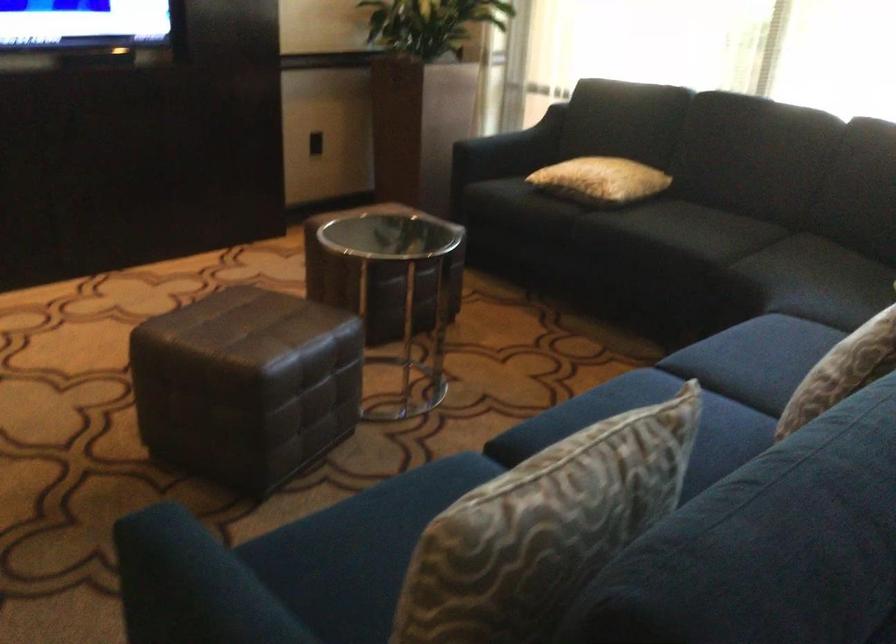
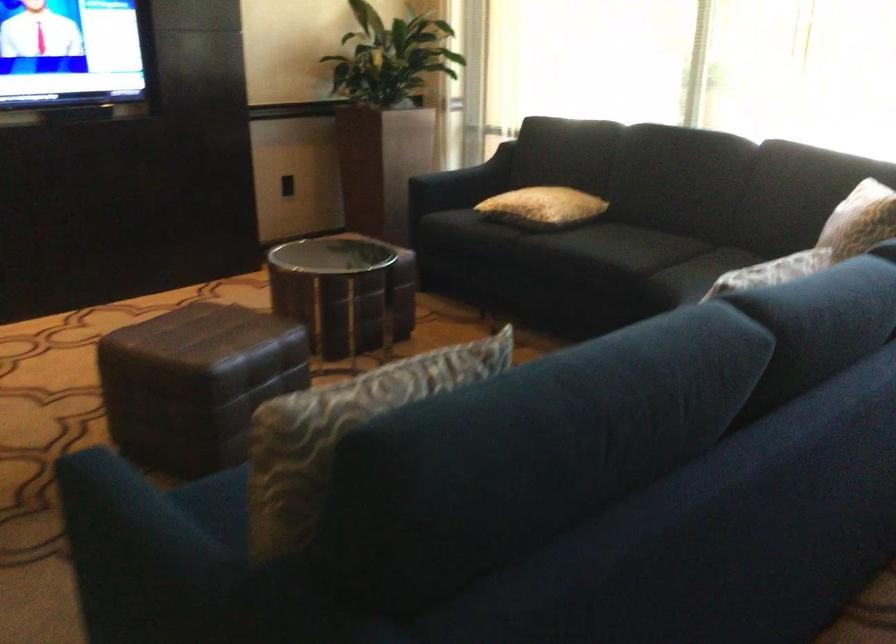
Question: The first image is from the beginning of the video and the second image is from the end. How did the camera likely rotate when shooting the video?

Choices:
 (A) Left
 (B) Right
 (C) Up
 (D) Down

Answer: (C)